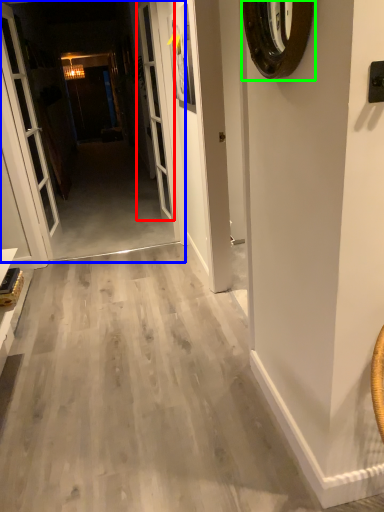
Question: Which is farther away from screen door (highlighted by a red box)? corridor (highlighted by a blue box) or clock (highlighted by a green box)?

Choices:
 (A) corridor
 (B) clock

Answer: (B)